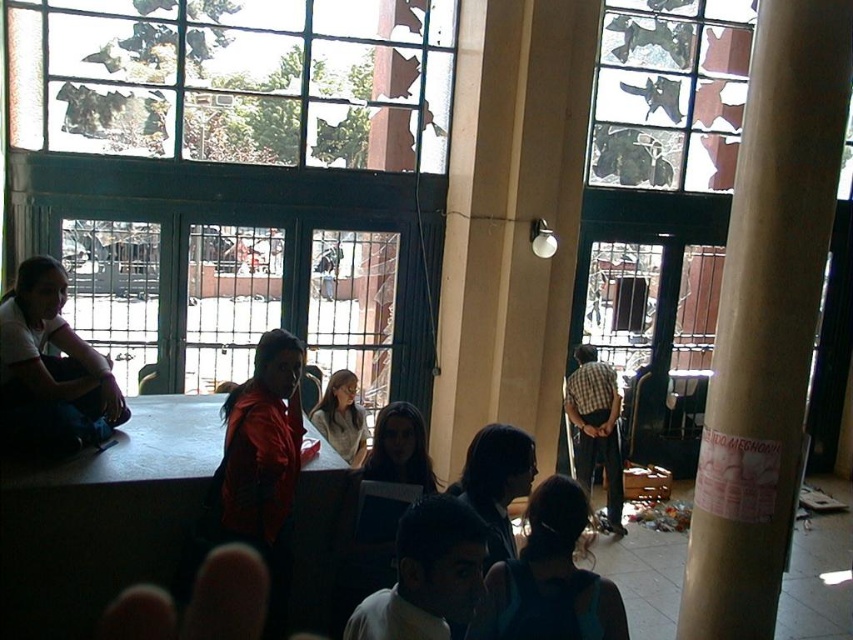
Question: Which object is the closest to the dark gray hoodie at center?

Choices:
 (A) transparent glass window at upper center
 (B) dark blue fabric at center

Answer: (B)

Question: Where is translucent glass window at upper center located in relation to dark blue fabric at center in the image?

Choices:
 (A) below
 (B) above

Answer: (B)

Question: Which of the following is the farthest from the observer?

Choices:
 (A) (616, 500)
 (B) (479, 490)
 (C) (30, 346)

Answer: (A)

Question: Which object is closer to the camera taking this photo?

Choices:
 (A) light gray sweater at center
 (B) dark blue fabric at center
 (C) checkered fabric shirt at center
 (D) translucent glass window at upper center

Answer: (B)

Question: Can you confirm if brown cardboard pillar at right is positioned to the left of dark blue fabric at center?

Choices:
 (A) yes
 (B) no

Answer: (B)

Question: Is brown cardboard pillar at right in front of matte white shirt at left?

Choices:
 (A) yes
 (B) no

Answer: (B)